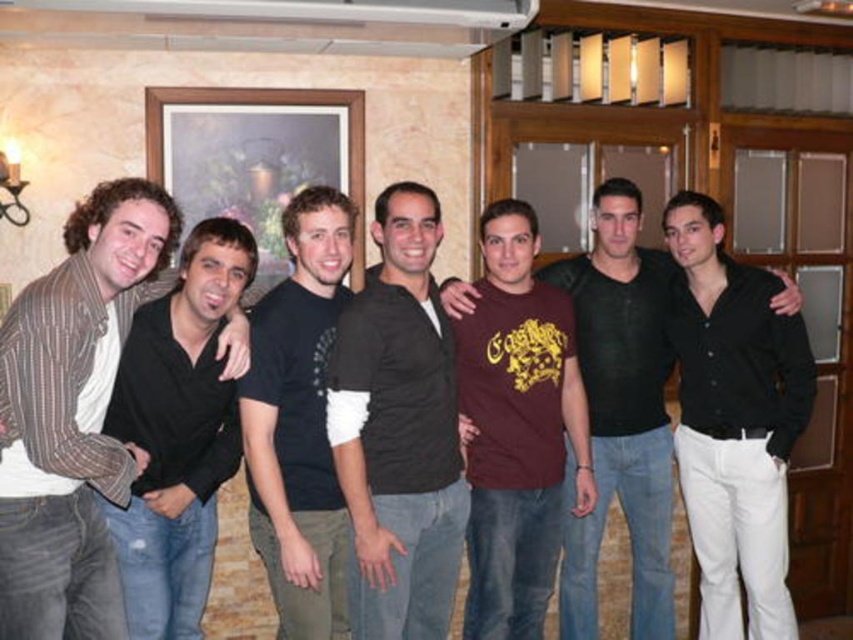
You are standing in the room and want to greet both the striped wool sweater at left and the dark brown shirt at center. Which person should you approach first based on their positions?

You should approach the striped wool sweater at left first because it is closer to you than the dark brown shirt at center.